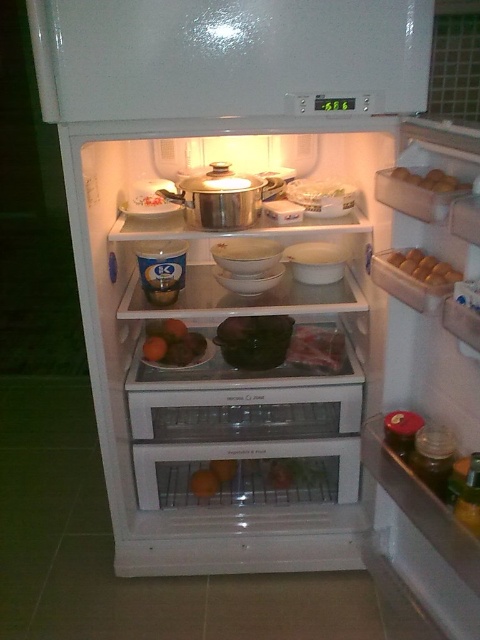
You are organizing the fridge and want to place a new container between the green matte vegetable at center and the brown matte eggs at upper right. Based on their sizes, which object should you consider moving to make space?

The green matte vegetable at center might be wider than the brown matte eggs at upper right, so you should consider moving the green matte vegetable at center to make more space for the new container.